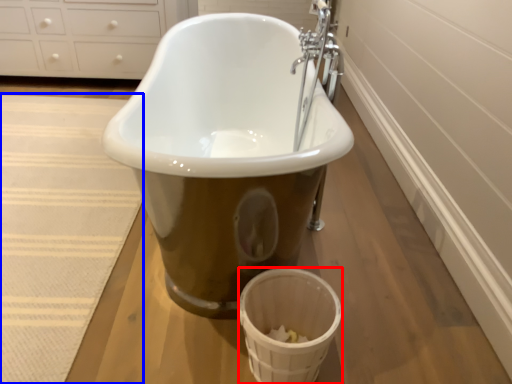
Question: Which point is closer to the camera, basket (highlighted by a red box) or bath mat (highlighted by a blue box)?

Choices:
 (A) basket
 (B) bath mat

Answer: (A)